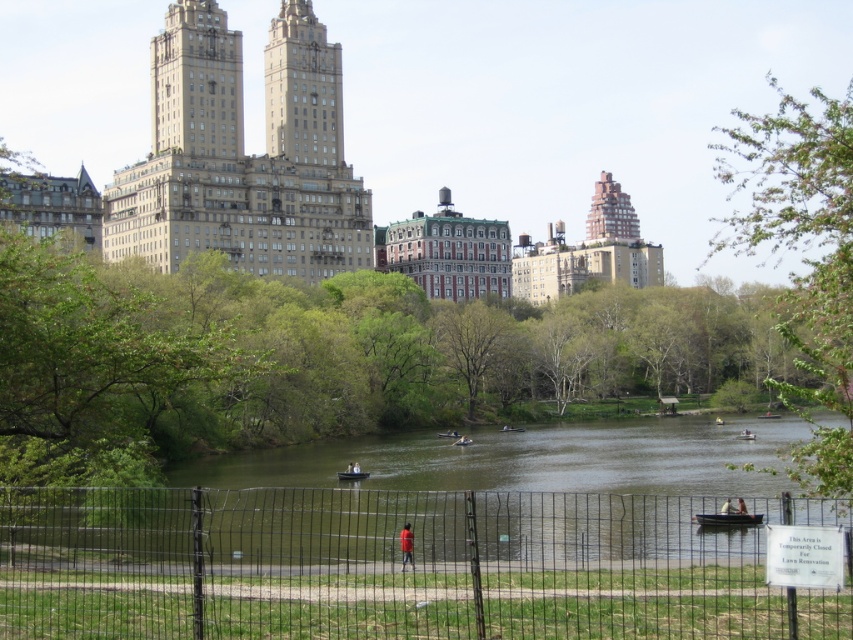
You are planning to take a photo of the wooden canoe at center and the green leafy tree at right. Based on their sizes in the image, which object would appear bigger in your photo?

The green leafy tree at right appears bigger in the photo because it has a larger size compared to the wooden canoe at center.

You are standing at the fence in the park and see the green leafy tree at right and the wooden canoe at center. Which object is positioned more to the east if the fence is facing north?

The green leafy tree at right is to the right of the wooden canoe at center. Since the fence is facing north, the right side would correspond to the east direction. Therefore, the green leafy tree at right is positioned more to the east.

In the serene urban park scene, you see a wooden rowboat at center and a wooden canoe at center. Which one is positioned to the left?

The wooden rowboat at center is positioned to the left of the wooden canoe at center.